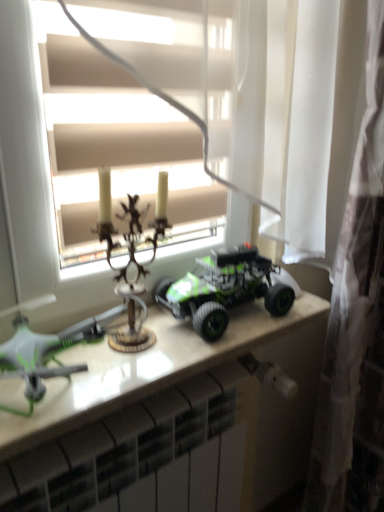
Question: From the image's perspective, would you say green matte drone at left, which ranks as the third toy in right-to-left order, is positioned over white glossy table at center?

Choices:
 (A) yes
 (B) no

Answer: (A)

Question: Is green matte drone at left, which ranks as the third toy in right-to-left order, further to camera compared to white glossy table at center?

Choices:
 (A) no
 (B) yes

Answer: (A)

Question: Is green matte drone at left, arranged as the 1th toy when viewed from the left, beside white glossy table at center?

Choices:
 (A) no
 (B) yes

Answer: (A)

Question: From a real-world perspective, is green matte drone at left, arranged as the 1th toy when viewed from the left, positioned under white glossy table at center based on gravity?

Choices:
 (A) yes
 (B) no

Answer: (B)

Question: Does green matte drone at left, which ranks as the third toy in right-to-left order, contain white glossy table at center?

Choices:
 (A) no
 (B) yes

Answer: (A)

Question: From a real-world perspective, is white glossy radiator at lower center positioned above or below white glossy table at center?

Choices:
 (A) above
 (B) below

Answer: (B)

Question: Looking at the image, does white glossy radiator at lower center seem bigger or smaller compared to white glossy table at center?

Choices:
 (A) small
 (B) big

Answer: (B)

Question: Considering the relative positions of white glossy radiator at lower center and white glossy table at center in the image provided, is white glossy radiator at lower center to the left or to the right of white glossy table at center?

Choices:
 (A) right
 (B) left

Answer: (B)

Question: Considering the positions of point [155, 404] and point [89, 373], is point [155, 404] closer or farther from the camera than point [89, 373]?

Choices:
 (A) closer
 (B) farther

Answer: (B)

Question: Does point (195, 290) appear closer or farther from the camera than point (82, 332)?

Choices:
 (A) farther
 (B) closer

Answer: (A)

Question: From a real-world perspective, relative to green matte drone at left, which ranks as the third toy in right-to-left order, is green matte toy truck at center, positioned as the 3th toy in left-to-right order, vertically above or below?

Choices:
 (A) above
 (B) below

Answer: (A)

Question: Would you say green matte toy truck at center, the first toy positioned from the right, is inside or outside green matte drone at left, which ranks as the third toy in right-to-left order?

Choices:
 (A) inside
 (B) outside

Answer: (B)

Question: Would you say green matte toy truck at center, the first toy positioned from the right, is to the left or to the right of green matte drone at left, arranged as the 1th toy when viewed from the left, in the picture?

Choices:
 (A) left
 (B) right

Answer: (B)

Question: From a real-world perspective, relative to matte white window at center, is green matte drone at left, arranged as the 1th toy when viewed from the left, vertically above or below?

Choices:
 (A) below
 (B) above

Answer: (A)

Question: Is green matte drone at left, which ranks as the third toy in right-to-left order, taller or shorter than matte white window at center?

Choices:
 (A) tall
 (B) short

Answer: (B)